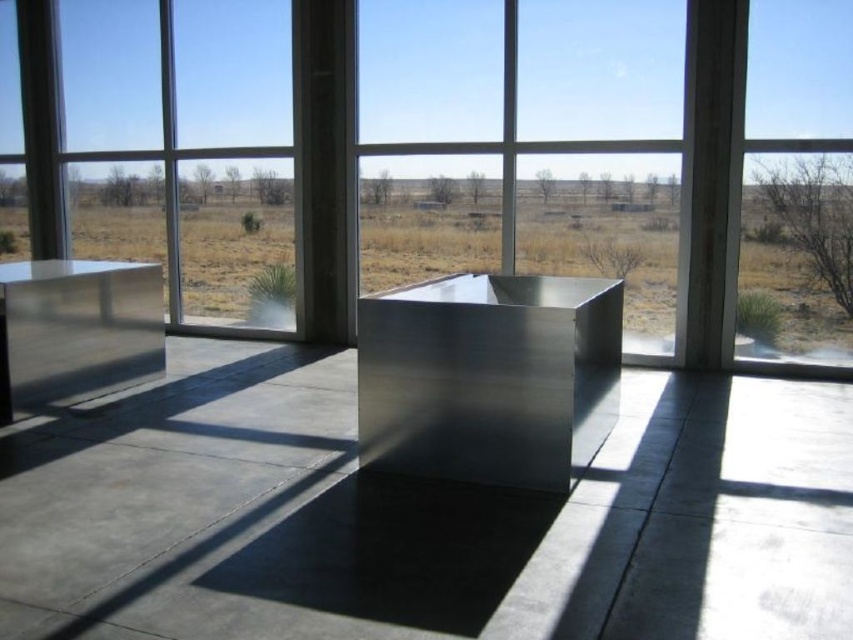
Question: From the image, what is the correct spatial relationship of metallic gray cube at center in relation to clear glass window at right?

Choices:
 (A) below
 (B) above

Answer: (A)

Question: Does metallic glass at center have a greater width compared to polished metallic box at center?

Choices:
 (A) yes
 (B) no

Answer: (A)

Question: Which point appears farthest from the camera in this image?

Choices:
 (A) pyautogui.click(x=538, y=557)
 (B) pyautogui.click(x=582, y=444)

Answer: (B)

Question: Among these objects, which one is nearest to the camera?

Choices:
 (A) metallic gray cube at center
 (B) polished metallic box at center

Answer: (A)

Question: Which of the following is the closest to the observer?

Choices:
 (A) (595, 44)
 (B) (403, 456)
 (C) (202, 513)

Answer: (C)

Question: Is metallic glass at center closer to camera compared to clear glass window at right?

Choices:
 (A) yes
 (B) no

Answer: (B)